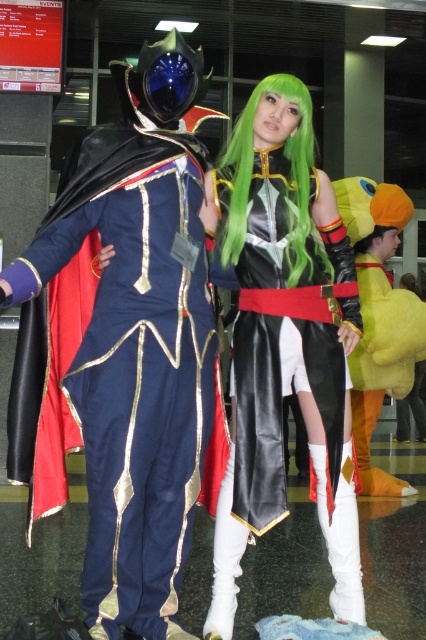
You are a photographer at the event and need to capture both the shiny blue fabric cape at left and the black leather dress at center in a single frame. Given that your camera has a fixed focal length and limited horizontal space, which object should you position closer to the center of the frame to ensure both fit without cropping?

To ensure both the shiny blue fabric cape at left and the black leather dress at center fit in the frame, position the shiny blue fabric cape at left closer to the center since its width is larger than the black leather dress at center, allowing for better composition without cropping.

You are a photographer at the event and need to frame a shot that includes both the shiny blue fabric cape at left and the green matte wig at center. Which object should you adjust your camera angle to prioritize if you want to ensure both are fully visible?

The shiny blue fabric cape at left might be wider than the green matte wig at center, so you should prioritize adjusting your camera angle to accommodate the width of the shiny blue fabric cape at left to ensure both are fully visible.